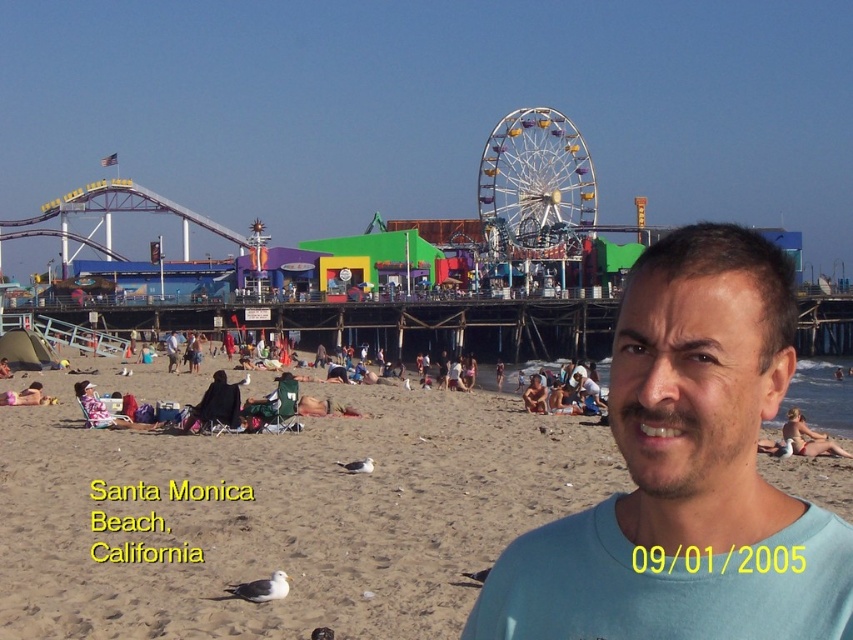
Question: Does beige sand at lower center appear over yellow metallic ferris wheel at center?

Choices:
 (A) no
 (B) yes

Answer: (A)

Question: Which object appears farthest from the camera in this image?

Choices:
 (A) light blue t-shirt at center
 (B) yellow metallic ferris wheel at center

Answer: (B)

Question: Is beige sand at lower center in front of yellow metallic ferris wheel at center?

Choices:
 (A) no
 (B) yes

Answer: (B)

Question: Which object is farther from the camera taking this photo?

Choices:
 (A) yellow metallic ferris wheel at center
 (B) light blue t-shirt at center
 (C) beige sand at lower center

Answer: (A)

Question: Does beige sand at lower center have a greater width compared to yellow metallic ferris wheel at center?

Choices:
 (A) yes
 (B) no

Answer: (A)

Question: Based on their relative distances, which object is nearer to the light blue t-shirt at center?

Choices:
 (A) beige sand at lower center
 (B) yellow metallic ferris wheel at center

Answer: (A)